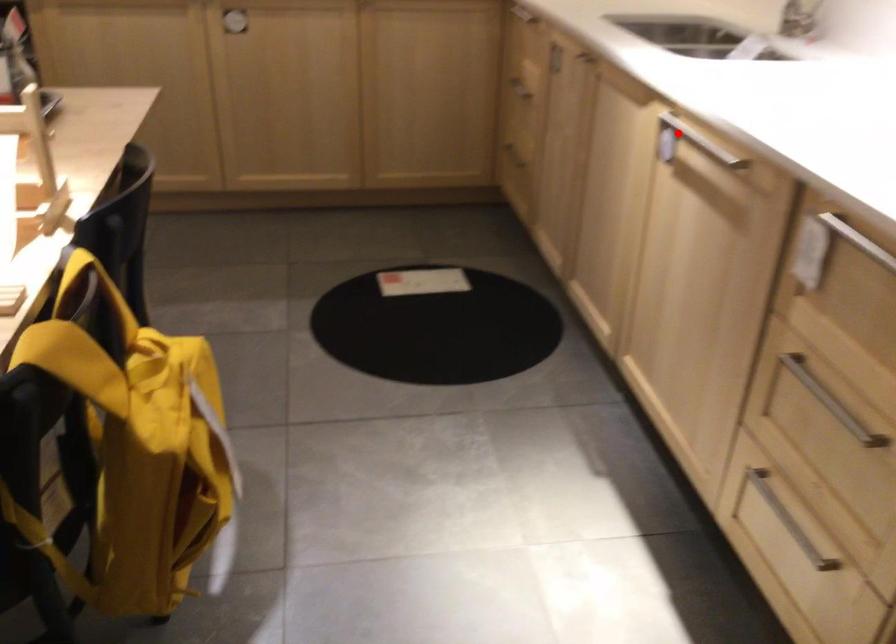
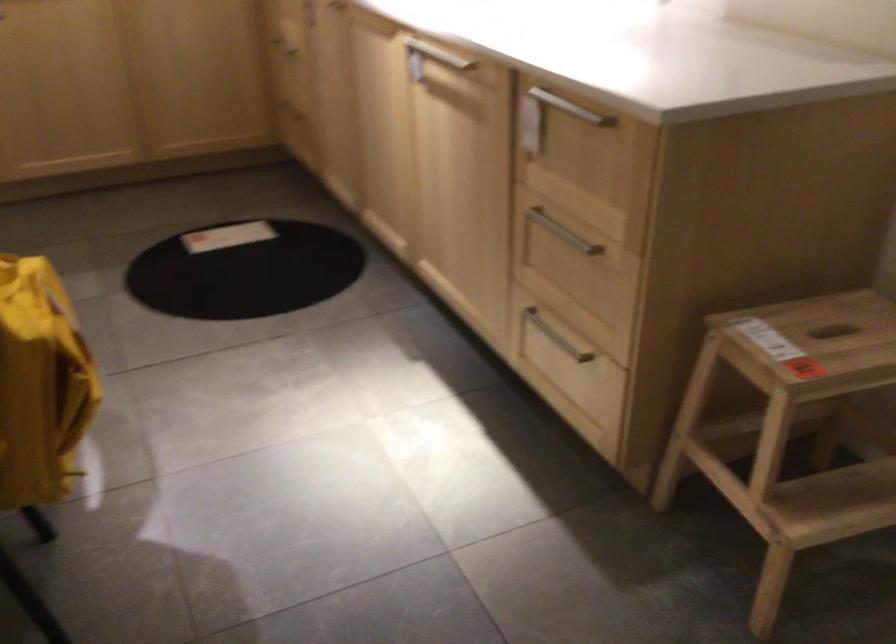
The point at the highlighted location is marked in the first image. Where is the corresponding point in the second image?

(428, 59)